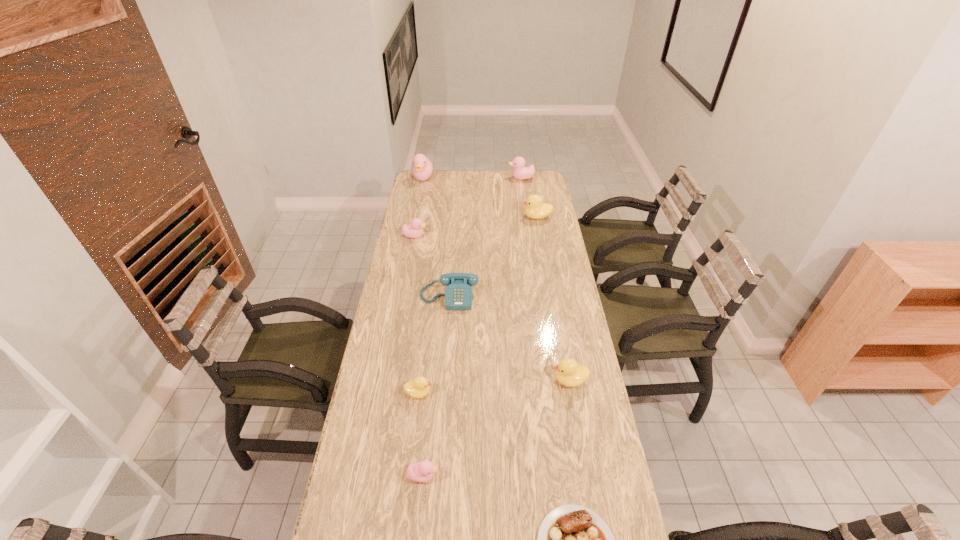
This screenshot has width=960, height=540. I want to click on free spot located on the front-facing side of the fourth farthest duckling, so click(453, 236).

Image resolution: width=960 pixels, height=540 pixels. Find the location of `vacant space located 0.130m on the beak of the second smallest yellow duckling`. vacant space located 0.130m on the beak of the second smallest yellow duckling is located at coordinates (514, 380).

This screenshot has height=540, width=960. Identify the location of vacant space situated 0.380m on the beak of the second smallest yellow duckling. (440, 380).

Locate an element on the screen. This screenshot has width=960, height=540. vacant region located on the beak of the second smallest yellow duckling is located at coordinates (502, 380).

Locate an element on the screen. The image size is (960, 540). free spot located on the dial of the blue telephone is located at coordinates (446, 334).

Image resolution: width=960 pixels, height=540 pixels. What are the coordinates of `vacant space situated 0.300m on the front-facing side of the nearest pink duckling` in the screenshot? It's located at (544, 476).

The image size is (960, 540). Find the location of `free space located on the beak of the leftmost yellow duckling`. free space located on the beak of the leftmost yellow duckling is located at coordinates (487, 393).

Find the location of a particular element. Image resolution: width=960 pixels, height=540 pixels. telephone located in the left edge section of the desktop is located at coordinates (458, 295).

Locate an element on the screen. object at the far left corner is located at coordinates (422, 169).

Locate an element on the screen. object present at the far right corner is located at coordinates (520, 172).